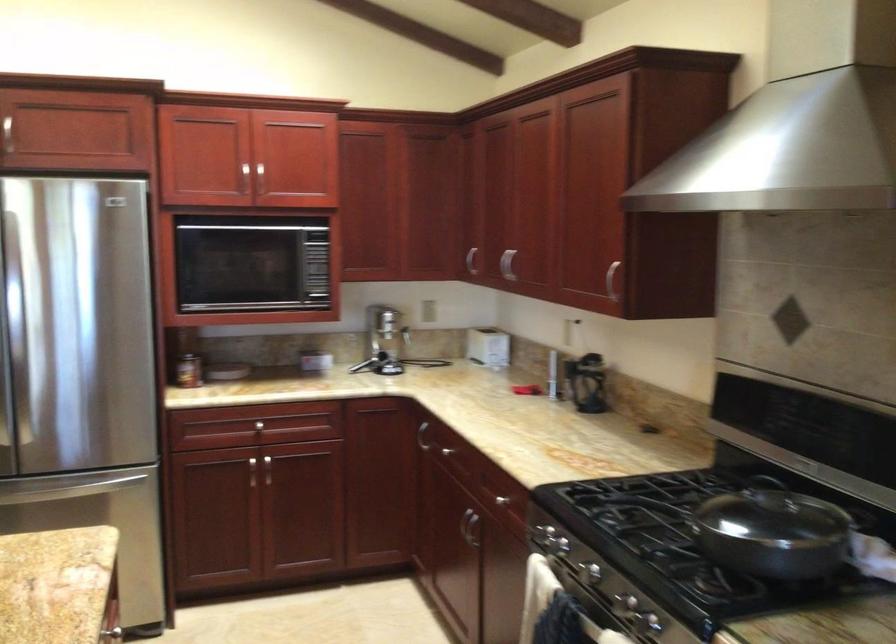
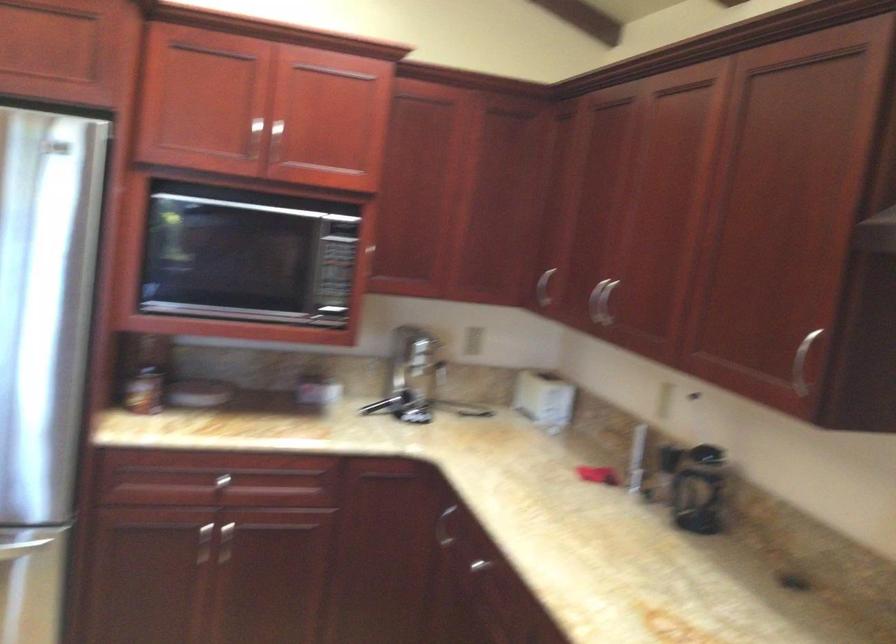
Where in the second image is the point corresponding to (x=470, y=259) from the first image?

(544, 287)